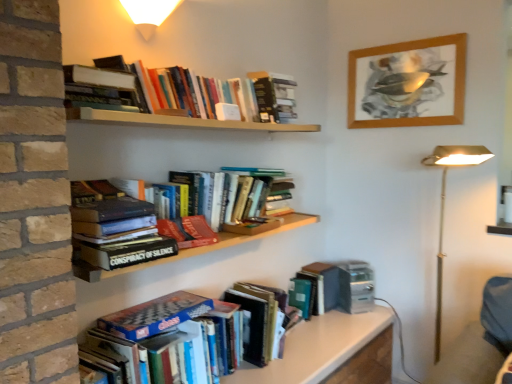
Identify the location of hardcover book at center, the fifth book positioned from the top. The image size is (512, 384). (188, 231).

Describe the element at coordinates (100, 86) in the screenshot. The width and height of the screenshot is (512, 384). I see `hardcover book at upper left, which is the fifth book from bottom to top` at that location.

Where is `white glossy table at lower center`? The image size is (512, 384). white glossy table at lower center is located at coordinates (317, 348).

Locate an element on the screen. This screenshot has width=512, height=384. metallic gold floor lamp at right is located at coordinates (444, 207).

Find the location of `hardcover book at center, the fifth book positioned from the top`. hardcover book at center, the fifth book positioned from the top is located at coordinates (188, 231).

From the image's perspective, is metallic gold floor lamp at right positioned above or below hardcover book at center, the fifth book positioned from the top?

From the image's perspective, metallic gold floor lamp at right appears below hardcover book at center, the fifth book positioned from the top.

Which point is more forward, (436, 334) or (201, 224)?

Point (201, 224)

Is metallic gold floor lamp at right not within hardcover book at center, the fifth book positioned from the top?

Yes, metallic gold floor lamp at right is not within hardcover book at center, the fifth book positioned from the top.

How far apart are matte white wall sconce at upper center and blue glossy chess set at lower center, marked as the 1th book in a bottom-to-top arrangement?

matte white wall sconce at upper center and blue glossy chess set at lower center, marked as the 1th book in a bottom-to-top arrangement, are 1.59 meters apart from each other.

Is matte white wall sconce at upper center beside blue glossy chess set at lower center, which is the 7th book from top to bottom?

No, matte white wall sconce at upper center is not next to blue glossy chess set at lower center, which is the 7th book from top to bottom.

Considering the positions of objects matte white wall sconce at upper center and blue glossy chess set at lower center, marked as the 1th book in a bottom-to-top arrangement, in the image provided, who is more to the left, matte white wall sconce at upper center or blue glossy chess set at lower center, marked as the 1th book in a bottom-to-top arrangement,?

matte white wall sconce at upper center.

Between hardcover book at center, the fifth book positioned from the top, and hardcover book at upper center, which appears as the 7th book when ordered from the bottom, which one has more height?

hardcover book at upper center, which appears as the 7th book when ordered from the bottom.

Considering the relative sizes of hardcover book at center, which is counted as the 3th book, starting from the bottom, and hardcover book at upper center, which is counted as the 1th book, starting from the top, in the image provided, is hardcover book at center, which is counted as the 3th book, starting from the bottom, bigger than hardcover book at upper center, which is counted as the 1th book, starting from the top,?

Incorrect, hardcover book at center, which is counted as the 3th book, starting from the bottom, is not larger than hardcover book at upper center, which is counted as the 1th book, starting from the top.

Which object is closer to the camera, hardcover book at center, which is counted as the 3th book, starting from the bottom, or hardcover book at upper center, which is counted as the 1th book, starting from the top?

hardcover book at center, which is counted as the 3th book, starting from the bottom, is closer to the camera.

Choose the correct answer: Is hardcover book at center, which is counted as the 3th book, starting from the bottom, inside hardcover book at upper center, which appears as the 7th book when ordered from the bottom, or outside it?

hardcover book at center, which is counted as the 3th book, starting from the bottom, lies outside hardcover book at upper center, which appears as the 7th book when ordered from the bottom.

In terms of height, does metallic gold floor lamp at right look taller or shorter compared to green matte book at lower center, arranged as the sixth book when viewed from the top?

Clearly, metallic gold floor lamp at right is taller compared to green matte book at lower center, arranged as the sixth book when viewed from the top.

Considering the sizes of metallic gold floor lamp at right and green matte book at lower center, which is counted as the second book, starting from the bottom, in the image, is metallic gold floor lamp at right wider or thinner than green matte book at lower center, which is counted as the second book, starting from the bottom,?

metallic gold floor lamp at right is wider than green matte book at lower center, which is counted as the second book, starting from the bottom.

Is metallic gold floor lamp at right placed right next to green matte book at lower center, which is counted as the second book, starting from the bottom?

metallic gold floor lamp at right and green matte book at lower center, which is counted as the second book, starting from the bottom, are not in contact.

Based on the photo, considering the relative positions of white glossy table at lower center and hardcover book at upper left, the 3th book positioned from the top, in the image provided, is white glossy table at lower center to the right of hardcover book at upper left, the 3th book positioned from the top, from the viewer's perspective?

Yes, white glossy table at lower center is to the right of hardcover book at upper left, the 3th book positioned from the top.

Can you tell me how much white glossy table at lower center and hardcover book at upper left, the 3th book positioned from the top, differ in facing direction?

The angular difference between white glossy table at lower center and hardcover book at upper left, the 3th book positioned from the top, is 0.000852 degrees.

Could you tell me if white glossy table at lower center is turned towards hardcover book at upper left, the 3th book positioned from the top?

No, white glossy table at lower center does not turn towards hardcover book at upper left, the 3th book positioned from the top.

Considering the sizes of objects hardcover book at upper center, which appears as the 7th book when ordered from the bottom, and hardcover book at center, the fifth book positioned from the top, in the image provided, who is taller, hardcover book at upper center, which appears as the 7th book when ordered from the bottom, or hardcover book at center, the fifth book positioned from the top,?

With more height is hardcover book at upper center, which appears as the 7th book when ordered from the bottom.

Is point (273, 110) positioned after point (179, 244)?

Yes, point (273, 110) is behind point (179, 244).

Does hardcover book at upper center, which appears as the 7th book when ordered from the bottom, touch hardcover book at center, the fifth book positioned from the top?

No.

From the image's perspective, relative to hardcover book at center, which is counted as the 3th book, starting from the bottom, is hardcover book at upper center, which is counted as the 1th book, starting from the top, above or below?

From the image's perspective, hardcover book at upper center, which is counted as the 1th book, starting from the top, appears above hardcover book at center, which is counted as the 3th book, starting from the bottom.

Would you say hardcover books at upper center, the 6th book from the bottom, is to the left or to the right of hardcover book at upper left, which is the fifth book from bottom to top, in the picture?

hardcover books at upper center, the 6th book from the bottom, is to the right of hardcover book at upper left, which is the fifth book from bottom to top.

Is hardcover books at upper center, the 6th book from the bottom, shorter than hardcover book at upper left, the 3th book positioned from the top?

No, hardcover books at upper center, the 6th book from the bottom, is not shorter than hardcover book at upper left, the 3th book positioned from the top.

Which point is more distant from viewer, (x=275, y=88) or (x=80, y=74)?

The point (x=275, y=88) is more distant.

Where is `the 1st book above the metallic gold floor lamp at right (from the image's perspective)`? the 1st book above the metallic gold floor lamp at right (from the image's perspective) is located at coordinates (188, 231).

Locate an element on the screen. book that is the 3rd object to the right of the matte white wall sconce at upper center, starting at the anchor is located at coordinates (352, 342).

Estimate the real-world distances between objects in this image. Which object is closer to metallic gold floor lamp at right, white glossy table at lower center or hardcover books at upper center, the 6th book from the bottom?

white glossy table at lower center is closer to metallic gold floor lamp at right.

Estimate the real-world distances between objects in this image. Which object is further from matte white wall sconce at upper center, hardcover book at upper center, which appears as the 7th book when ordered from the bottom, or green matte book at lower center, which is counted as the second book, starting from the bottom?

green matte book at lower center, which is counted as the second book, starting from the bottom, is further to matte white wall sconce at upper center.

When comparing their distances from hardcover books at upper center, which is counted as the second book, starting from the top, does hardcover book at upper center, which is counted as the 1th book, starting from the top, or hardcover book at center, which ranks as the fourth book in bottom-to-top order, seem closer?

hardcover book at upper center, which is counted as the 1th book, starting from the top, is closer to hardcover books at upper center, which is counted as the second book, starting from the top.

From the image, which object appears to be nearer to hardcover book at center, the fifth book positioned from the top, wooden picture frame at upper right or metallic gold floor lamp at right?

metallic gold floor lamp at right.

Estimate the real-world distances between objects in this image. Which object is closer to green matte book at lower center, which is counted as the second book, starting from the bottom, hardcover book at upper center, which is counted as the 1th book, starting from the top, or hardcover book at center, the fifth book positioned from the top?

hardcover book at upper center, which is counted as the 1th book, starting from the top.

Looking at this image, considering their positions, is matte white wall sconce at upper center positioned closer to hardcover book at center, arranged as the fourth book when viewed from the top, than white glossy table at lower center?

matte white wall sconce at upper center is positioned closer to the anchor hardcover book at center, arranged as the fourth book when viewed from the top.

Estimate the real-world distances between objects in this image. Which object is closer to hardcover book at upper left, which is the fifth book from bottom to top, metallic gold floor lamp at right or hardcover book at upper center, which appears as the 7th book when ordered from the bottom?

The object closer to hardcover book at upper left, which is the fifth book from bottom to top, is hardcover book at upper center, which appears as the 7th book when ordered from the bottom.

Based on their spatial positions, is green matte book at lower center, which is counted as the second book, starting from the bottom, or hardcover book at upper center, which is counted as the 1th book, starting from the top, further from hardcover book at center, arranged as the fourth book when viewed from the top?

The object further to hardcover book at center, arranged as the fourth book when viewed from the top, is green matte book at lower center, which is counted as the second book, starting from the bottom.

This screenshot has height=384, width=512. Find the location of `table lamp between matte white wall sconce at upper center and green matte book at lower center, arranged as the sixth book when viewed from the top, in the up-down direction`. table lamp between matte white wall sconce at upper center and green matte book at lower center, arranged as the sixth book when viewed from the top, in the up-down direction is located at coordinates (444, 207).

Where is `table located between hardcover book at upper left, which is the fifth book from bottom to top, and metallic gold floor lamp at right in the left-right direction`? table located between hardcover book at upper left, which is the fifth book from bottom to top, and metallic gold floor lamp at right in the left-right direction is located at coordinates (317, 348).

You are a GUI agent. You are given a task and a screenshot of the screen. Output one action in this format:
    pyautogui.click(x=<x>, y=<y>)
    Task: Click on the table lamp between wooden picture frame at upper right and blue glossy chess set at lower center, which is the 7th book from top to bottom, in the up-down direction
    Image resolution: width=512 pixels, height=384 pixels.
    Given the screenshot: What is the action you would take?
    pyautogui.click(x=444, y=207)

This screenshot has height=384, width=512. Identify the location of light fixture located between hardcover book at center, arranged as the fourth book when viewed from the top, and green matte book at lower center, arranged as the sixth book when viewed from the top, in the depth direction. (149, 14).